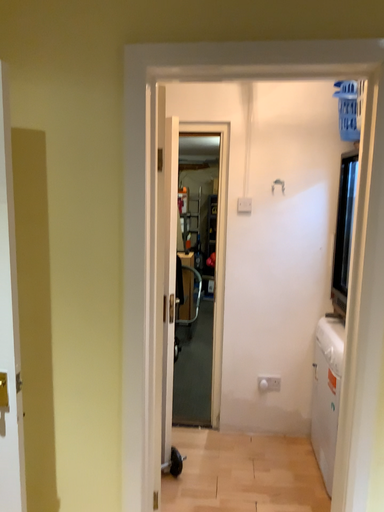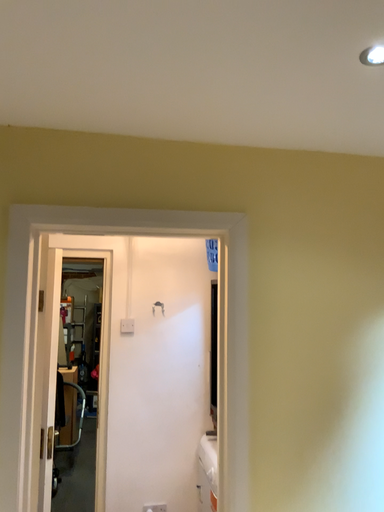
Question: Which way did the camera rotate in the video?

Choices:
 (A) rotated downward
 (B) rotated upward

Answer: (B)